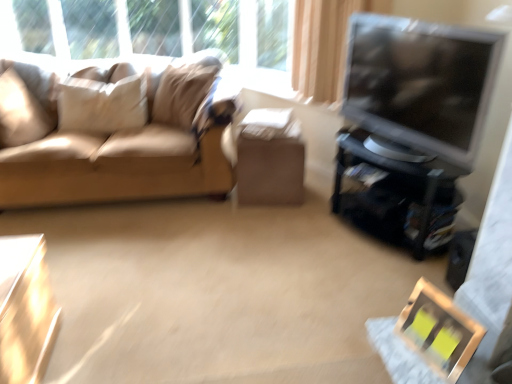
Locate an element on the screen. free space between matte cardboard box at center, placed as the first table when sorted from top to bottom, and matte black tv stand at right is located at coordinates (315, 224).